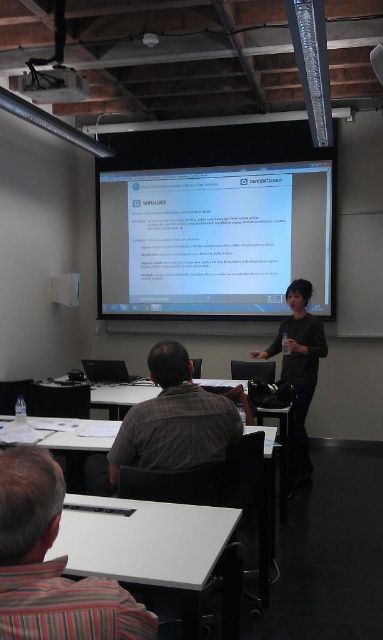
This screenshot has height=640, width=383. What do you see at coordinates (214, 240) in the screenshot?
I see `white glossy projector screen at upper center` at bounding box center [214, 240].

Who is more forward, (330, 248) or (88, 625)?

Point (88, 625) is more forward.

The width and height of the screenshot is (383, 640). Find the location of `white glossy projector screen at upper center`. white glossy projector screen at upper center is located at coordinates (214, 240).

Between point (75, 636) and point (299, 292), which one is positioned behind?

The point (299, 292) is more distant.

This screenshot has width=383, height=640. What do you see at coordinates (52, 564) in the screenshot?
I see `striped fabric shirt at lower left` at bounding box center [52, 564].

Identify the location of striped fabric shirt at lower left. The image size is (383, 640). (52, 564).

Who is positioned more to the left, white glossy projector screen at upper center or black matte shirt at center?

white glossy projector screen at upper center

Can you confirm if white glossy projector screen at upper center is positioned below black matte shirt at center?

No, white glossy projector screen at upper center is not below black matte shirt at center.

Who is more distant from viewer, [170,282] or [296,317]?

Point [170,282]

Where is `white glossy projector screen at upper center`? white glossy projector screen at upper center is located at coordinates (214, 240).